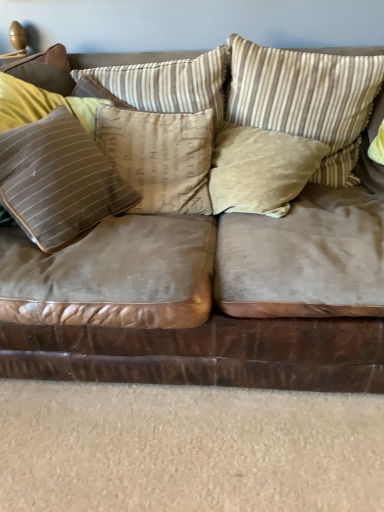
Question: Can you confirm if velvet beige pillow at center, the second pillow in the right-to-left sequence, is thinner than suede-like brown pillow at left, which ranks as the first pillow in left-to-right order?

Choices:
 (A) no
 (B) yes

Answer: (A)

Question: Does velvet beige pillow at center, the second pillow in the right-to-left sequence, appear on the left side of suede-like brown pillow at left, which appears as the fifth pillow when viewed from the right?

Choices:
 (A) no
 (B) yes

Answer: (A)

Question: Can you confirm if velvet beige pillow at center, the second pillow in the right-to-left sequence, is smaller than suede-like brown pillow at left, which ranks as the first pillow in left-to-right order?

Choices:
 (A) no
 (B) yes

Answer: (B)

Question: Considering the relative sizes of velvet beige pillow at center, which is counted as the fourth pillow, starting from the left, and suede-like brown pillow at left, which ranks as the first pillow in left-to-right order, in the image provided, is velvet beige pillow at center, which is counted as the fourth pillow, starting from the left, taller than suede-like brown pillow at left, which ranks as the first pillow in left-to-right order,?

Choices:
 (A) yes
 (B) no

Answer: (B)

Question: Is velvet beige pillow at center, the second pillow in the right-to-left sequence, at the right side of suede-like brown pillow at left, which appears as the fifth pillow when viewed from the right?

Choices:
 (A) yes
 (B) no

Answer: (A)

Question: Is velvet beige pillow at center, the second pillow in the right-to-left sequence, bigger than suede-like brown pillow at left, which appears as the fifth pillow when viewed from the right?

Choices:
 (A) no
 (B) yes

Answer: (A)

Question: Are suede-like brown pillow at left, which ranks as the first pillow in left-to-right order, and brown striped pillow at upper right, the 5th pillow when ordered from left to right, far apart?

Choices:
 (A) yes
 (B) no

Answer: (B)

Question: From the image's perspective, is suede-like brown pillow at left, which ranks as the first pillow in left-to-right order, under brown striped pillow at upper right, the 5th pillow when ordered from left to right?

Choices:
 (A) yes
 (B) no

Answer: (A)

Question: Is suede-like brown pillow at left, which appears as the fifth pillow when viewed from the right, at the left side of brown striped pillow at upper right, which is the 1th pillow from right to left?

Choices:
 (A) yes
 (B) no

Answer: (A)

Question: Considering the relative sizes of suede-like brown pillow at left, which appears as the fifth pillow when viewed from the right, and brown striped pillow at upper right, the 5th pillow when ordered from left to right, in the image provided, is suede-like brown pillow at left, which appears as the fifth pillow when viewed from the right, thinner than brown striped pillow at upper right, the 5th pillow when ordered from left to right,?

Choices:
 (A) yes
 (B) no

Answer: (A)

Question: Does suede-like brown pillow at left, which ranks as the first pillow in left-to-right order, come behind brown striped pillow at upper right, which is the 1th pillow from right to left?

Choices:
 (A) no
 (B) yes

Answer: (A)

Question: Is suede-like brown pillow at left, which ranks as the first pillow in left-to-right order, oriented towards brown striped pillow at upper right, which is the 1th pillow from right to left?

Choices:
 (A) yes
 (B) no

Answer: (B)

Question: Is suede-like brown pillow at left, which appears as the fifth pillow when viewed from the right, further to camera compared to brown suede couch at center?

Choices:
 (A) yes
 (B) no

Answer: (A)